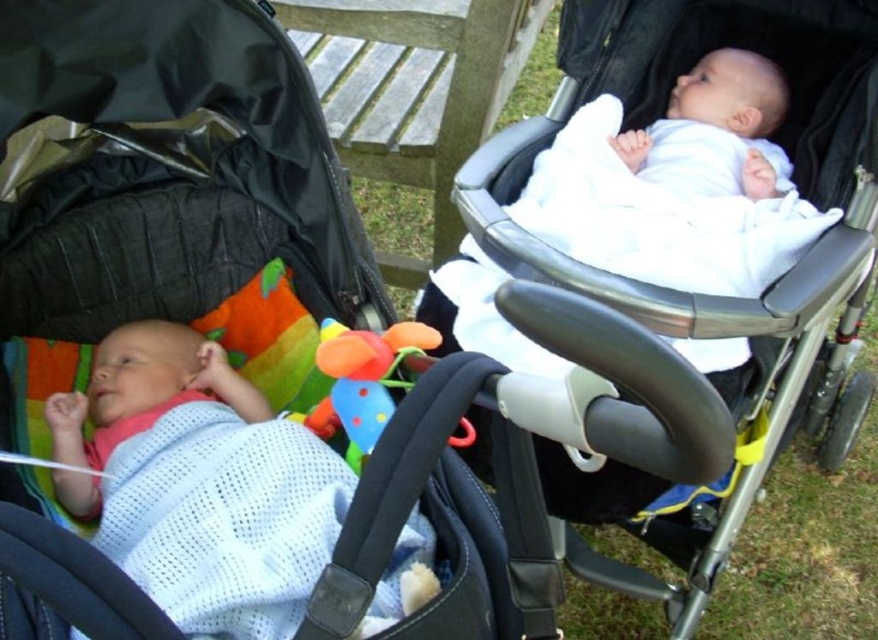
Question: Which point is closer to the camera taking this photo?

Choices:
 (A) (364, 394)
 (B) (802, 317)
 (C) (353, 227)
 (D) (630, 134)

Answer: (A)

Question: Estimate the real-world distances between objects in this image. Which object is closer to the white knitted fabric baby at left?

Choices:
 (A) white soft baby at upper right
 (B) white fabric baby carriage at upper center
 (C) matte black stroller at left

Answer: (C)

Question: Does white knitted fabric baby at left appear on the left side of white soft baby at upper right?

Choices:
 (A) yes
 (B) no

Answer: (A)

Question: Is matte black stroller at left positioned in front of white knitted fabric baby at left?

Choices:
 (A) yes
 (B) no

Answer: (A)

Question: Based on their relative distances, which object is farther from the white knitted fabric baby at left?

Choices:
 (A) white soft baby at upper right
 (B) matte black stroller at left
 (C) plastic soft toy at center

Answer: (A)

Question: Is white fabric baby carriage at upper center below white knitted fabric baby at left?

Choices:
 (A) no
 (B) yes

Answer: (A)